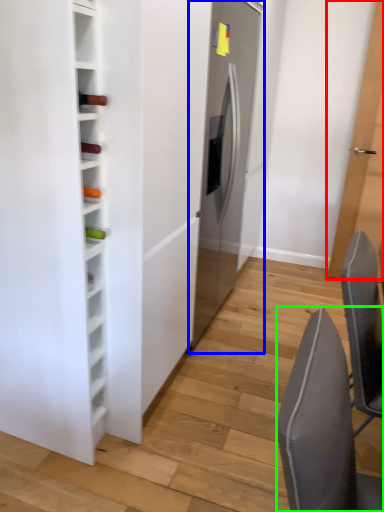
Question: Considering the real-world distances, which object is farthest from door (highlighted by a red box)? fridge (highlighted by a blue box) or chair (highlighted by a green box)?

Choices:
 (A) fridge
 (B) chair

Answer: (B)